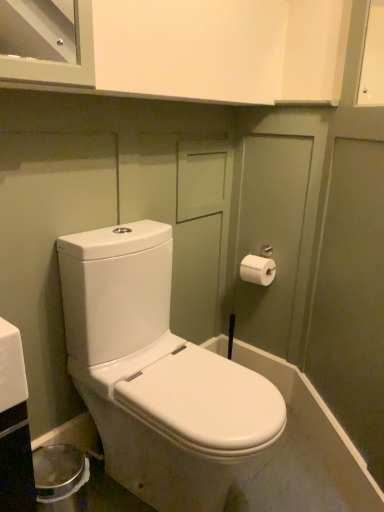
Question: Is white matte toilet paper at right bigger than white glossy toilet at center?

Choices:
 (A) yes
 (B) no

Answer: (B)

Question: Does white matte toilet paper at right lie in front of white glossy toilet at center?

Choices:
 (A) no
 (B) yes

Answer: (A)

Question: Is white matte toilet paper at right not within white glossy toilet at center?

Choices:
 (A) no
 (B) yes

Answer: (B)

Question: Would you say white matte toilet paper at right is a long distance from white glossy toilet at center?

Choices:
 (A) no
 (B) yes

Answer: (A)

Question: Is white matte toilet paper at right at the right side of white glossy toilet at center?

Choices:
 (A) no
 (B) yes

Answer: (B)

Question: From a real-world perspective, is white matte toilet paper at right positioned over white glossy toilet at center based on gravity?

Choices:
 (A) no
 (B) yes

Answer: (B)

Question: Does white glossy toilet at center come behind white matte toilet paper at right?

Choices:
 (A) yes
 (B) no

Answer: (B)

Question: From a real-world perspective, is white glossy toilet at center located beneath white matte toilet paper at right?

Choices:
 (A) no
 (B) yes

Answer: (B)

Question: Is white glossy toilet at center next to white matte toilet paper at right?

Choices:
 (A) yes
 (B) no

Answer: (B)

Question: From a real-world perspective, is white glossy toilet at center physically above white matte toilet paper at right?

Choices:
 (A) yes
 (B) no

Answer: (B)

Question: Can you confirm if white glossy toilet at center is smaller than white matte toilet paper at right?

Choices:
 (A) yes
 (B) no

Answer: (B)

Question: Is white matte toilet paper at right inside white glossy toilet at center?

Choices:
 (A) no
 (B) yes

Answer: (A)

Question: From the image's perspective, is white glossy toilet at center positioned above or below white matte toilet paper at right?

Choices:
 (A) above
 (B) below

Answer: (B)